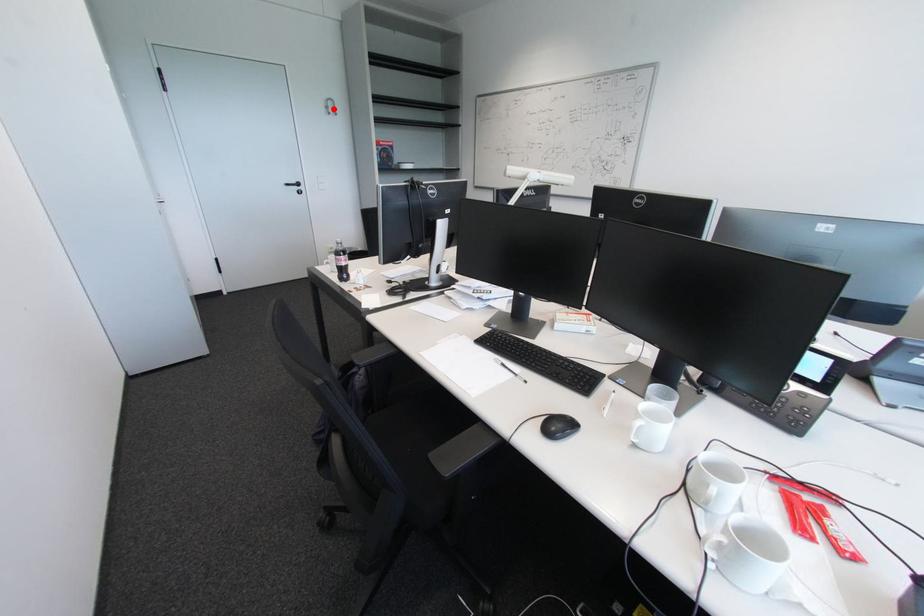
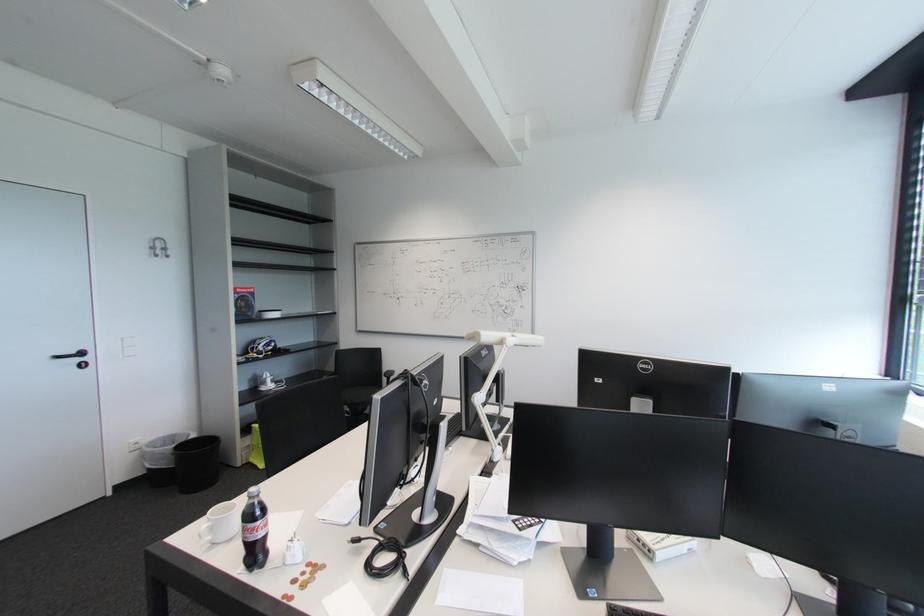
Find the pixel in the second image that matches the highlighted location in the first image.

(159, 249)